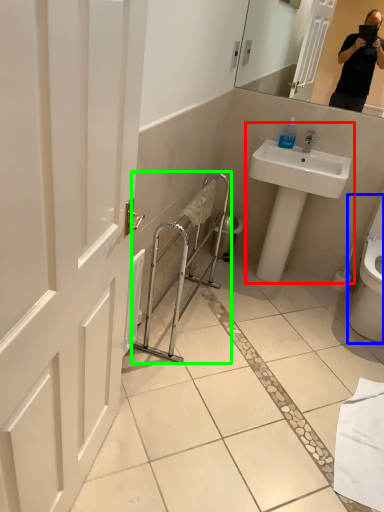
Question: Considering the real-world distances, which object is farthest from sink (highlighted by a red box)? toilet (highlighted by a blue box) or balustrade (highlighted by a green box)?

Choices:
 (A) toilet
 (B) balustrade

Answer: (A)